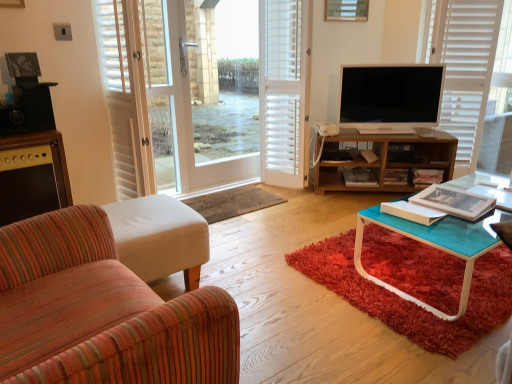
The height and width of the screenshot is (384, 512). Find the location of `vacant space that is in between white plastic corded phone at center and flat screen tv at center`. vacant space that is in between white plastic corded phone at center and flat screen tv at center is located at coordinates (373, 129).